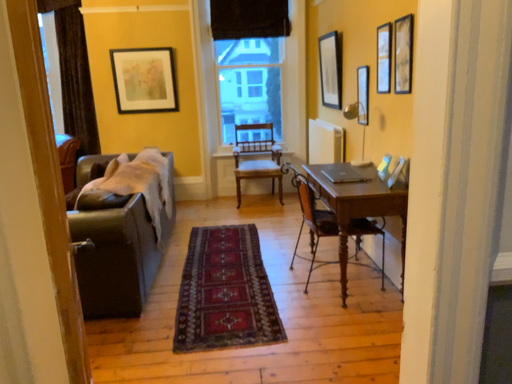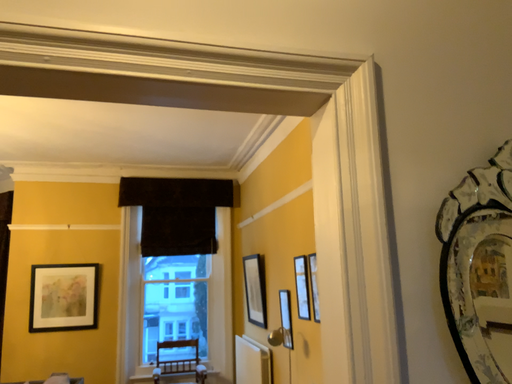
Question: How did the camera likely rotate when shooting the video?

Choices:
 (A) rotated downward
 (B) rotated upward

Answer: (B)